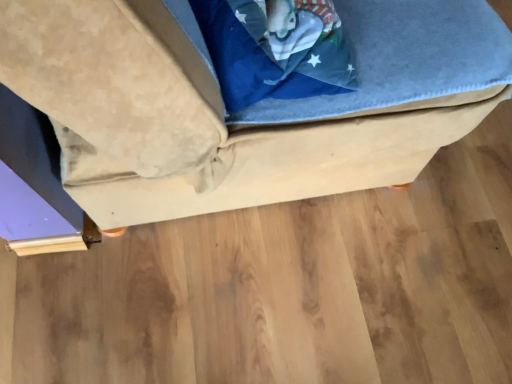
Question: Is suede-like beige ottoman at center inside or outside of wooden floor at lower center?

Choices:
 (A) outside
 (B) inside

Answer: (A)

Question: In terms of size, does suede-like beige ottoman at center appear bigger or smaller than wooden floor at lower center?

Choices:
 (A) big
 (B) small

Answer: (A)

Question: Does point (308, 195) appear closer or farther from the camera than point (507, 269)?

Choices:
 (A) farther
 (B) closer

Answer: (A)

Question: In the image, is wooden floor at lower center on the left side or the right side of suede-like beige ottoman at center?

Choices:
 (A) right
 (B) left

Answer: (A)

Question: Which is correct: wooden floor at lower center is inside suede-like beige ottoman at center, or outside of it?

Choices:
 (A) outside
 (B) inside

Answer: (A)

Question: Looking at the image, does wooden floor at lower center seem bigger or smaller compared to suede-like beige ottoman at center?

Choices:
 (A) big
 (B) small

Answer: (B)

Question: Considering the positions of wooden floor at lower center and suede-like beige ottoman at center in the image, is wooden floor at lower center wider or thinner than suede-like beige ottoman at center?

Choices:
 (A) wide
 (B) thin

Answer: (A)